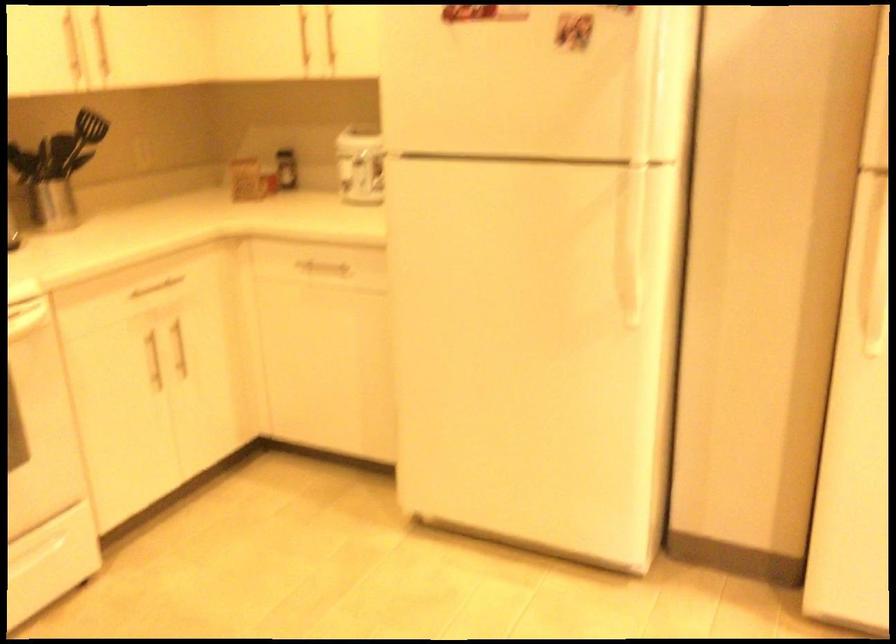
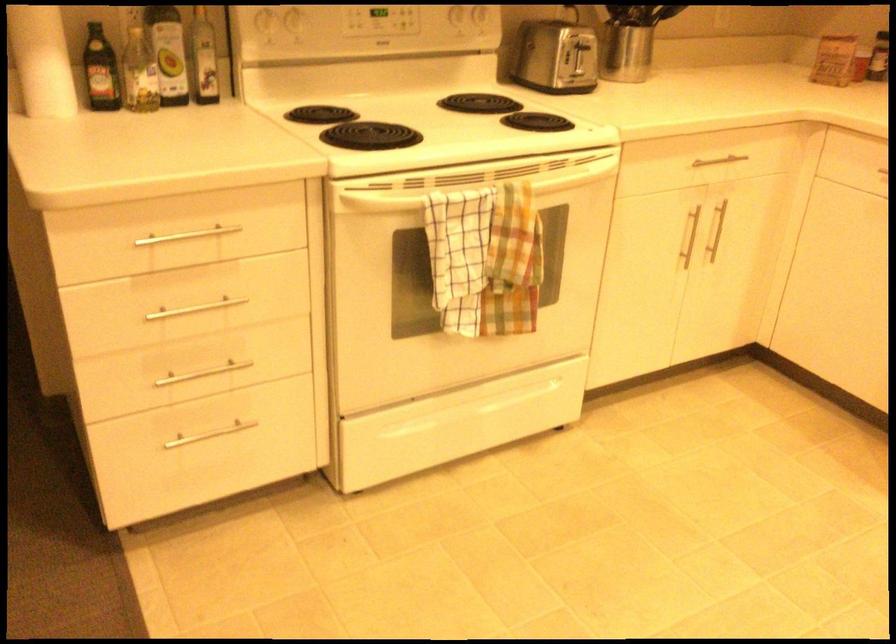
Where in the second image is the point corresponding to (186,281) from the first image?

(745, 164)